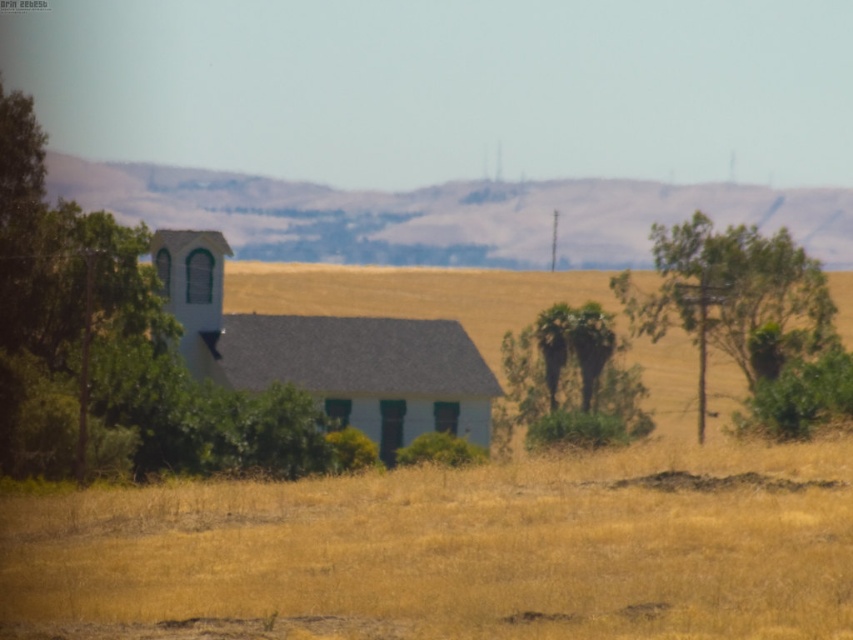
You are standing in the rural landscape and want to walk from the point closer to you to the point further away. Which path would you take between the two points, point (32,449) and point (306,346)?

The point closer to the viewer is point (32,449), so you should walk from point (32,449) to point (306,346) to reach the further point.

You are standing at the center of the image and want to walk to the green leafy tree at left. In which direction should you go?

The green leafy tree at left is located at the left side of the image, so you should walk to the left to reach it.

You are standing in the field of dry grass and want to walk from the green leafy tree at left to the white matte church at center. Which direction should you move to get closer to the church?

You should move towards the center direction because the white matte church at center is located in the central area of the scene, while the green leafy tree at left is positioned to the left side. Moving toward the center will bring you closer to the church.